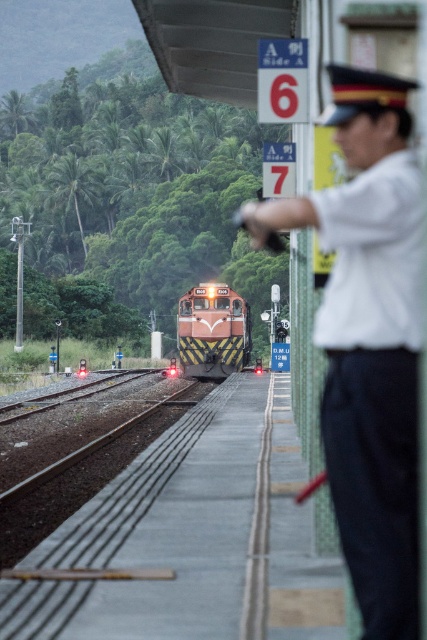
Does white uniform at right have a greater width compared to matte orange train at center?

No.

What are the coordinates of `white uniform at right` in the screenshot? It's located at (368, 339).

Identify the location of white uniform at right. (368, 339).